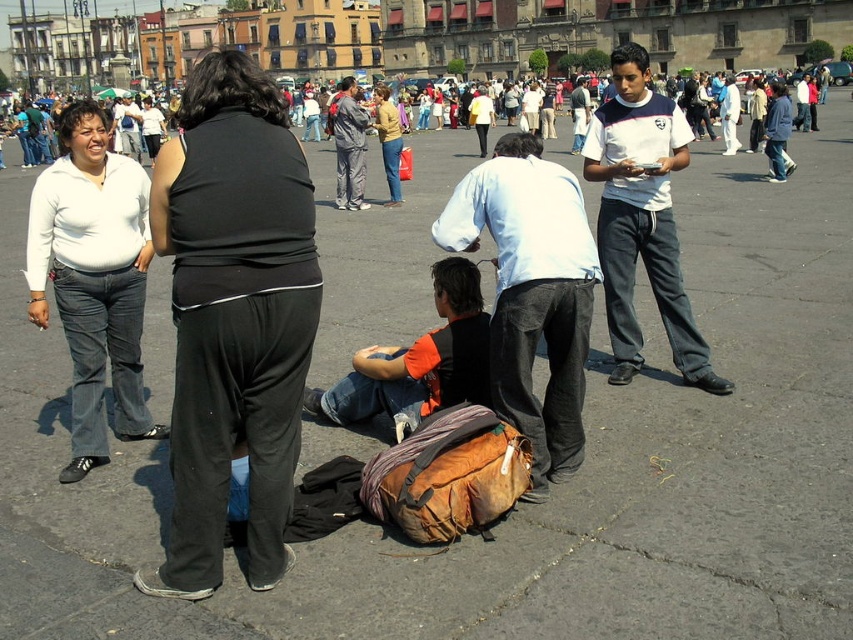
You are a photographer trying to capture a candid shot of the two people at the center of the scene. The black fabric pants at center and the matte black shirt at center are both in your frame. Based on their heights, which one would you focus on first if you want to ensure the taller object is in focus?

The matte black shirt at center is taller than the black fabric pants at center, so you should focus on the matte black shirt at center first to ensure the taller object is in focus.

In the scene shown: You are standing at the point marked as point (531, 292) in the image. Looking around, you see a woman in white shirt and jeans to your left and a person in black facing away to your right. Which direction should you turn to face the light blue shirt at center?

The point (531, 292) corresponds to the light blue shirt at center, so you are already facing that direction.